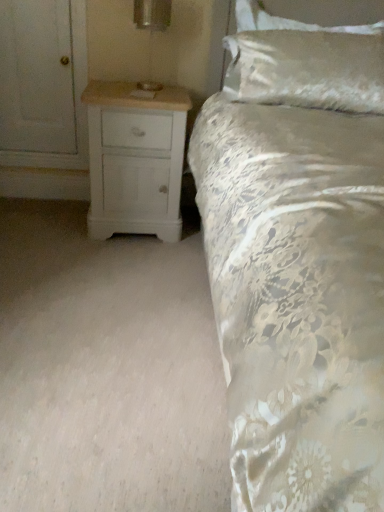
The width and height of the screenshot is (384, 512). What do you see at coordinates (307, 69) in the screenshot?
I see `silky white pillow at upper right` at bounding box center [307, 69].

Measure the distance between point (157,8) and camera.

The distance of point (157,8) from camera is 6.37 feet.

What is the approximate width of metallic silver table lamp at upper center?

metallic silver table lamp at upper center is 6.60 inches in width.

Find the location of a particular element. This screenshot has height=512, width=384. white wood chest of drawers at lower left is located at coordinates (135, 159).

You are a GUI agent. You are given a task and a screenshot of the screen. Output one action in this format:
    pyautogui.click(x=<x>, y=<y>)
    Task: Click on the silky white pillow at upper right
    
    Given the screenshot: What is the action you would take?
    pyautogui.click(x=307, y=69)

Which of these two, silky white pillow at upper right or white wood chest of drawers at lower left, is bigger?

white wood chest of drawers at lower left.

Considering the sizes of silky white pillow at upper right and white wood chest of drawers at lower left in the image, is silky white pillow at upper right wider or thinner than white wood chest of drawers at lower left?

Clearly, silky white pillow at upper right has less width compared to white wood chest of drawers at lower left.

I want to click on pillow to the right of white wood chest of drawers at lower left, so click(307, 69).

Between white wood chest of drawers at lower left and silky white pillow at upper right, which one has smaller width?

silky white pillow at upper right.

From the image's perspective, between white wood chest of drawers at lower left and silky white pillow at upper right, which one is located above?

From the image's view, silky white pillow at upper right is above.

Could you tell me if white wood chest of drawers at lower left is facing silky white pillow at upper right?

No, white wood chest of drawers at lower left does not turn towards silky white pillow at upper right.

Find the location of a particular element. the chest of drawers in front of the metallic silver table lamp at upper center is located at coordinates (135, 159).

From the image's perspective, is metallic silver table lamp at upper center below white wood chest of drawers at lower left?

No.

From a real-world perspective, is metallic silver table lamp at upper center positioned above or below white wood chest of drawers at lower left?

metallic silver table lamp at upper center is above white wood chest of drawers at lower left.

Is metallic silver table lamp at upper center facing away from white wood chest of drawers at lower left?

metallic silver table lamp at upper center does not have its back to white wood chest of drawers at lower left.

Which is nearer, (187, 100) or (159, 16)?

Point (187, 100) appears to be closer to the viewer than point (159, 16).

How much distance is there between white wood chest of drawers at lower left and metallic silver table lamp at upper center?

The distance of white wood chest of drawers at lower left from metallic silver table lamp at upper center is 38.35 centimeters.

What's the angular difference between white wood chest of drawers at lower left and metallic silver table lamp at upper center's facing directions?

They differ by 0.00547 degrees in their facing directions.

From a real-world perspective, does white wood chest of drawers at lower left sit lower than metallic silver table lamp at upper center?

Yes, from a real-world perspective, white wood chest of drawers at lower left is below metallic silver table lamp at upper center.

Is metallic silver table lamp at upper center to the right of silky white pillow at upper right from the viewer's perspective?

Incorrect, metallic silver table lamp at upper center is not on the right side of silky white pillow at upper right.

Which is nearer, (157, 2) or (294, 88)?

Point (157, 2) is positioned farther from the camera compared to point (294, 88).

Does metallic silver table lamp at upper center come behind silky white pillow at upper right?

No.

How many degrees apart are the facing directions of metallic silver table lamp at upper center and silky white pillow at upper right?

1.19 degrees separate the facing orientations of metallic silver table lamp at upper center and silky white pillow at upper right.

Based on their sizes in the image, would you say silky white pillow at upper right is bigger or smaller than metallic silver table lamp at upper center?

Considering their sizes, silky white pillow at upper right takes up more space than metallic silver table lamp at upper center.

Based on the photo, in the image, is silky white pillow at upper right positioned in front of or behind metallic silver table lamp at upper center?

silky white pillow at upper right is behind metallic silver table lamp at upper center.

Is silky white pillow at upper right shorter than metallic silver table lamp at upper center?

No.

Does silky white pillow at upper right appear on the left side of metallic silver table lamp at upper center?

No, silky white pillow at upper right is not to the left of metallic silver table lamp at upper center.

Where is `the chest of drawers lying below the silky white pillow at upper right (from the image's perspective)`? This screenshot has width=384, height=512. the chest of drawers lying below the silky white pillow at upper right (from the image's perspective) is located at coordinates (135, 159).

I want to click on the chest of drawers beneath the silky white pillow at upper right (from a real-world perspective), so click(135, 159).

From the image, which object appears to be farther from white wood chest of drawers at lower left, metallic silver table lamp at upper center or silky white pillow at upper right?

silky white pillow at upper right.

From the image, which object appears to be farther from white wood chest of drawers at lower left, silky white pillow at upper right or metallic silver table lamp at upper center?

silky white pillow at upper right is positioned further to the anchor white wood chest of drawers at lower left.

Considering their positions, is metallic silver table lamp at upper center positioned further to silky white pillow at upper right than white wood chest of drawers at lower left?

metallic silver table lamp at upper center is positioned further to the anchor silky white pillow at upper right.

Considering their positions, is white wood chest of drawers at lower left positioned closer to metallic silver table lamp at upper center than silky white pillow at upper right?

white wood chest of drawers at lower left.

Considering their positions, is silky white pillow at upper right positioned closer to metallic silver table lamp at upper center than white wood chest of drawers at lower left?

The object closer to metallic silver table lamp at upper center is white wood chest of drawers at lower left.

Which object lies further to the anchor point silky white pillow at upper right, white wood chest of drawers at lower left or metallic silver table lamp at upper center?

metallic silver table lamp at upper center lies further to silky white pillow at upper right than the other object.

This screenshot has width=384, height=512. I want to click on table lamp located between white wood chest of drawers at lower left and silky white pillow at upper right in the left-right direction, so click(151, 31).